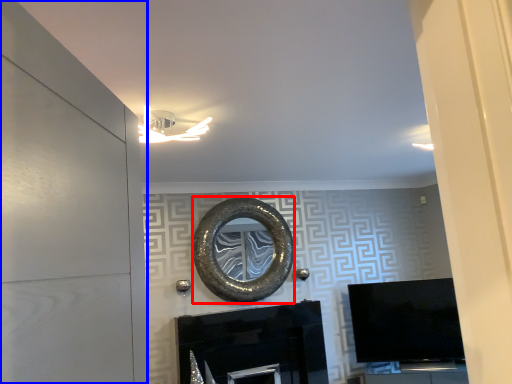
Question: Among these objects, which one is nearest to the camera, oval (highlighted by a red box) or door (highlighted by a blue box)?

Choices:
 (A) oval
 (B) door

Answer: (B)